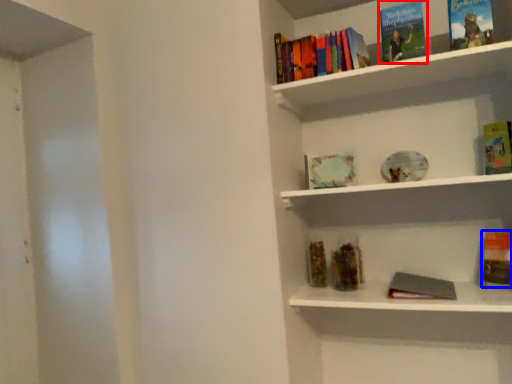
Question: Which object appears closest to the camera in this image, book (highlighted by a red box) or book (highlighted by a blue box)?

Choices:
 (A) book
 (B) book

Answer: (A)